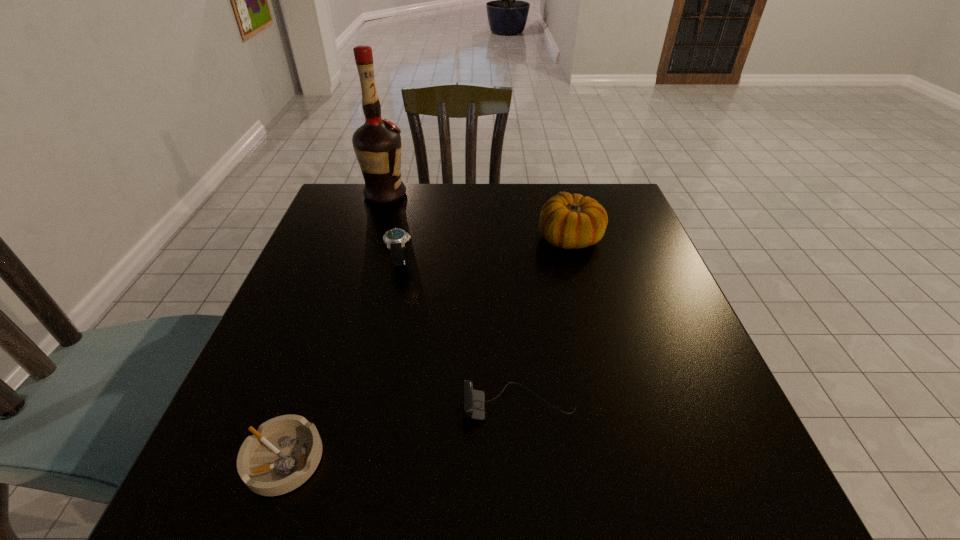
Identify the location of free space located on the front-facing side of the fourth tallest object. The height and width of the screenshot is (540, 960). (370, 404).

Locate an element on the screen. The height and width of the screenshot is (540, 960). vacant region located 0.190m on the front-facing side of the fourth tallest object is located at coordinates (352, 404).

At what (x,y) coordinates should I click in order to perform the action: click on vacant space located on the right of the shortest object. Please return your answer as a coordinate pair (x, y). The width and height of the screenshot is (960, 540). Looking at the image, I should click on (392, 459).

Find the location of a particular element. The image size is (960, 540). liquor that is at the far edge is located at coordinates (377, 143).

Locate an element on the screen. This screenshot has width=960, height=540. gourd that is positioned at the far edge is located at coordinates (568, 221).

This screenshot has height=540, width=960. Identify the location of object at the near edge. coord(284,452).

Where is `liquor present at the left edge`? The height and width of the screenshot is (540, 960). liquor present at the left edge is located at coordinates (377, 143).

This screenshot has width=960, height=540. Identify the location of ashtray that is at the left edge. (284, 452).

The image size is (960, 540). Find the location of `object that is at the right edge`. object that is at the right edge is located at coordinates (568, 221).

You are a GUI agent. You are given a task and a screenshot of the screen. Output one action in this format:
    pyautogui.click(x=<x>, y=<y>)
    Task: Click on the object that is at the far left corner
    
    Given the screenshot: What is the action you would take?
    pyautogui.click(x=377, y=143)